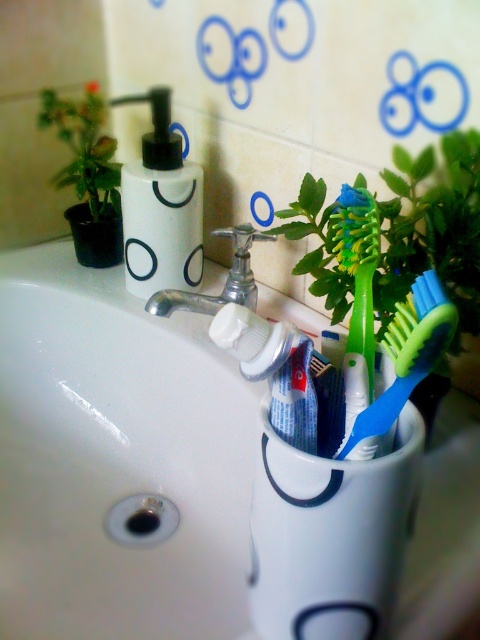
You are organizing the bathroom items and want to place the white matte toothpaste at center and the green rubber toothbrush at center in a vertical arrangement. Which item should be placed on top to follow the current setup?

The green rubber toothbrush at center should be placed on top since the white matte toothpaste at center is positioned under it in the current setup.

You are standing in front of the bathroom sink and see two points marked on the scene. The first point is at coordinate point (172, 268) and the second is at point (343, 257). Which point is closer to you?

Point (172, 268) is closer to you because it is further to the viewer than point (343, 257).

You are organizing the bathroom and want to place the white matte soap dispenser at upper left and the green plastic toothbrush at center on a shelf. If the shelf has limited height, which item might not fit if the height restriction is 10 cm?

The white matte soap dispenser at upper left is much taller than the green plastic toothbrush at center. If the height restriction is 10 cm, the white matte soap dispenser at upper left might not fit due to its greater height.